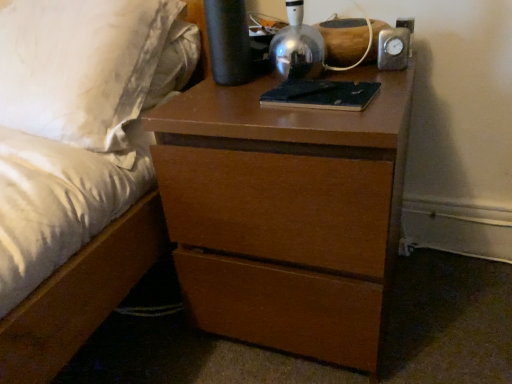
Question: Would you say matte brown bed at center is a long distance from dark blue leather book at center?

Choices:
 (A) no
 (B) yes

Answer: (A)

Question: From a real-world perspective, is matte brown bed at center on dark blue leather book at center?

Choices:
 (A) no
 (B) yes

Answer: (A)

Question: Considering the relative sizes of matte brown bed at center and dark blue leather book at center in the image provided, is matte brown bed at center smaller than dark blue leather book at center?

Choices:
 (A) yes
 (B) no

Answer: (B)

Question: Considering the relative positions of matte brown bed at center and dark blue leather book at center in the image provided, is matte brown bed at center behind dark blue leather book at center?

Choices:
 (A) yes
 (B) no

Answer: (B)

Question: Is matte brown bed at center shorter than dark blue leather book at center?

Choices:
 (A) no
 (B) yes

Answer: (A)

Question: Is matte brown bed at center in front of or behind dark blue leather book at center in the image?

Choices:
 (A) front
 (B) behind

Answer: (A)

Question: Is point (157, 221) closer or farther from the camera than point (344, 104)?

Choices:
 (A) farther
 (B) closer

Answer: (A)

Question: Which is correct: matte brown bed at center is inside dark blue leather book at center, or outside of it?

Choices:
 (A) inside
 (B) outside

Answer: (B)

Question: Is matte brown bed at center to the left or to the right of dark blue leather book at center in the image?

Choices:
 (A) left
 (B) right

Answer: (A)

Question: From the image's perspective, is metallic dome at upper center located above or below matte brown bed at center?

Choices:
 (A) above
 (B) below

Answer: (A)

Question: In terms of size, does metallic dome at upper center appear bigger or smaller than matte brown bed at center?

Choices:
 (A) small
 (B) big

Answer: (A)

Question: Considering the positions of point (324, 49) and point (40, 352), is point (324, 49) closer or farther from the camera than point (40, 352)?

Choices:
 (A) closer
 (B) farther

Answer: (B)

Question: Visually, is metallic dome at upper center positioned to the left or to the right of matte brown bed at center?

Choices:
 (A) left
 (B) right

Answer: (B)

Question: Is point (304, 24) closer or farther from the camera than point (305, 97)?

Choices:
 (A) closer
 (B) farther

Answer: (B)

Question: Is metallic dome at upper center wider or thinner than dark blue leather book at center?

Choices:
 (A) wide
 (B) thin

Answer: (B)